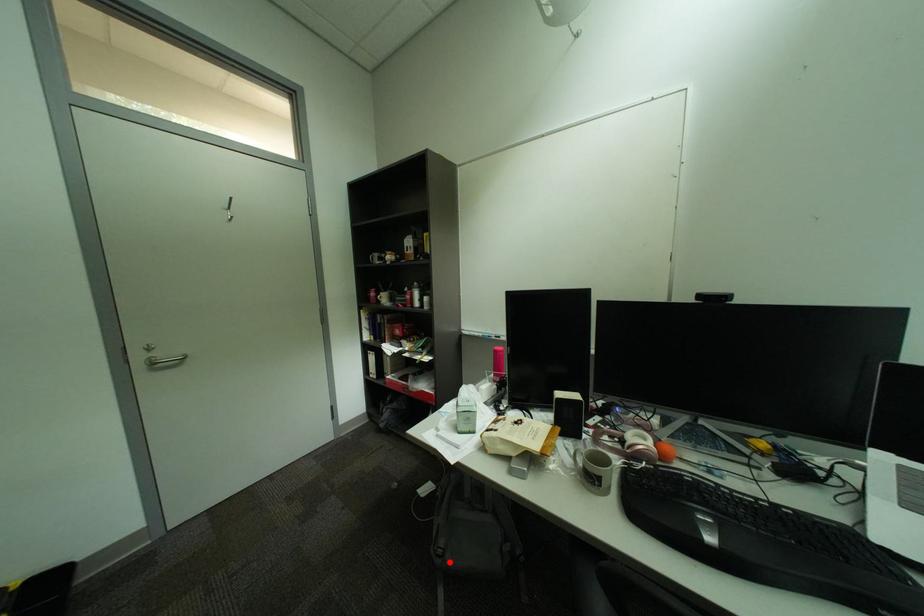
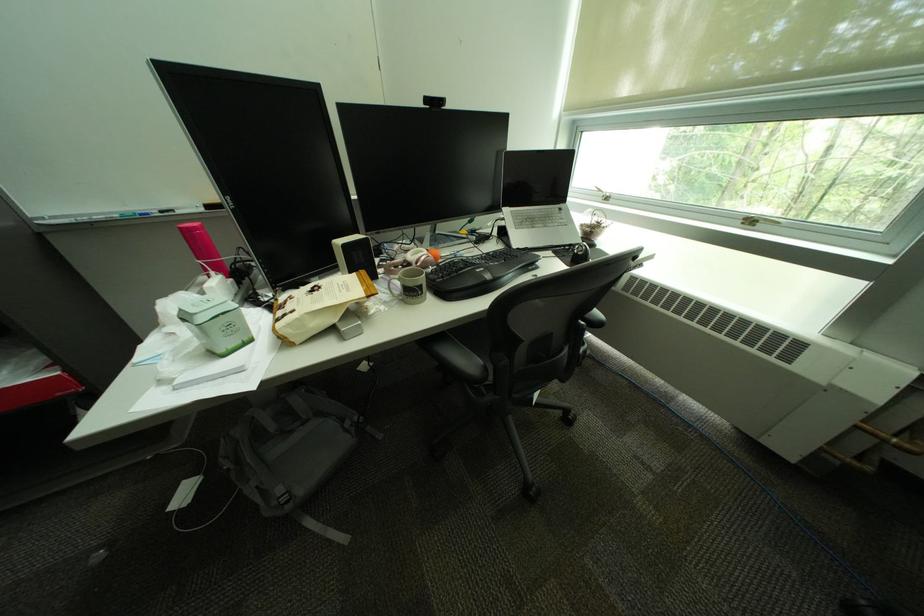
Question: I am providing you with two images of the same scene from different viewpoints. In image1, a red point is highlighted. Considering the same 3D point in image2, which of the following is correct?

Choices:
 (A) It is closer
 (B) It is farther

Answer: (A)